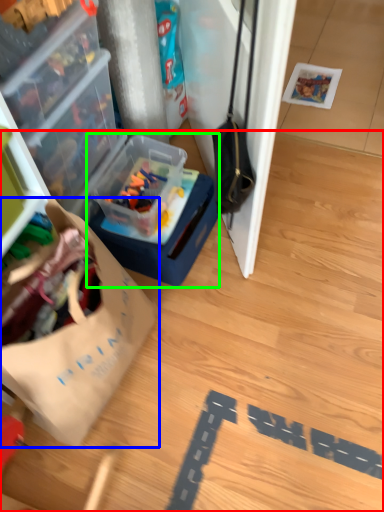
Question: Which object is positioned farthest from wood (highlighted by a red box)? Select from wrapping paper (highlighted by a blue box) and box (highlighted by a green box).

Choices:
 (A) wrapping paper
 (B) box

Answer: (A)